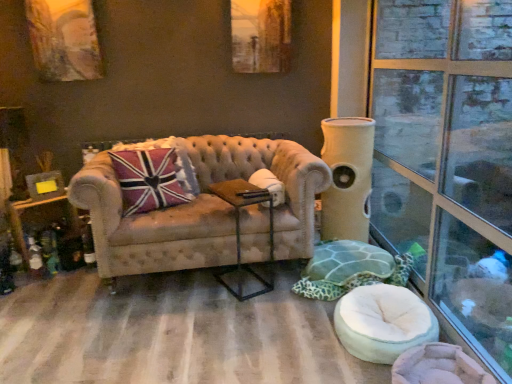
What do you see at coordinates (153, 178) in the screenshot? I see `union jack fabric pillow at center` at bounding box center [153, 178].

What do you see at coordinates (351, 269) in the screenshot? Image resolution: width=512 pixels, height=384 pixels. I see `green fabric swivel chair at lower right, placed as the 2th swivel chair when sorted from front to back` at bounding box center [351, 269].

The height and width of the screenshot is (384, 512). What do you see at coordinates (239, 229) in the screenshot?
I see `metallic brown side table at center` at bounding box center [239, 229].

Identify the location of clear glass window at right. (449, 158).

How much space does white fabric swivel chair at lower right, placed as the second swivel chair when sorted from back to front, occupy vertically?

white fabric swivel chair at lower right, placed as the second swivel chair when sorted from back to front, is 21.66 centimeters in height.

In order to click on union jack fabric pillow at center in this screenshot , I will do `click(153, 178)`.

In the image, there is a clear glass window at right. Identify the location of studio couch below it (from the image's perspective). (205, 211).

Is clear glass window at right looking in the opposite direction of tufted beige couch at center?

No, tufted beige couch at center is not at the back of clear glass window at right.

Does point (478, 162) appear closer or farther from the camera than point (241, 215)?

Point (478, 162).

Does clear glass window at right have a larger size compared to tufted beige couch at center?

Actually, clear glass window at right might be smaller than tufted beige couch at center.

From a real-world perspective, is union jack fabric pillow at center physically below beige fabric cat tower at right?

No, from a real-world perspective, union jack fabric pillow at center is not beneath beige fabric cat tower at right.

Considering the relative sizes of union jack fabric pillow at center and beige fabric cat tower at right in the image provided, is union jack fabric pillow at center smaller than beige fabric cat tower at right?

Yes.

Is union jack fabric pillow at center shorter than beige fabric cat tower at right?

Correct, union jack fabric pillow at center is not as tall as beige fabric cat tower at right.

How many degrees apart are the facing directions of union jack fabric pillow at center and beige fabric cat tower at right?

union jack fabric pillow at center and beige fabric cat tower at right are facing 8.19 degrees away from each other.

From a real-world perspective, which object stands above the other?

In real-world perspective, beige fabric cat tower at right is above.

Who is shorter, white fabric swivel chair at lower right, which is the 1th swivel chair from front to back, or beige fabric cat tower at right?

With less height is white fabric swivel chair at lower right, which is the 1th swivel chair from front to back.

From the image's perspective, between white fabric swivel chair at lower right, which is the 1th swivel chair from front to back, and beige fabric cat tower at right, which one is located above?

From the image's view, beige fabric cat tower at right is above.

Are metallic brown side table at center and white fabric swivel chair at lower right, which is the 1th swivel chair from front to back, located far from each other?

metallic brown side table at center is near white fabric swivel chair at lower right, which is the 1th swivel chair from front to back, not far away.

Identify the location of swivel chair in front of the metallic brown side table at center. (383, 322).

How far apart are metallic brown side table at center and white fabric swivel chair at lower right, which is the 1th swivel chair from front to back?

metallic brown side table at center is 31.57 inches from white fabric swivel chair at lower right, which is the 1th swivel chair from front to back.

From a real-world perspective, who is located higher, metallic brown side table at center or white fabric swivel chair at lower right, which is the 1th swivel chair from front to back?

In real-world perspective, metallic brown side table at center is above.

Does tufted beige couch at center have a greater width compared to clear glass window at right?

Yes, tufted beige couch at center is wider than clear glass window at right.

Considering the sizes of tufted beige couch at center and clear glass window at right in the image, is tufted beige couch at center taller or shorter than clear glass window at right?

Considering their sizes, tufted beige couch at center has less height than clear glass window at right.

The image size is (512, 384). There is a tufted beige couch at center. Identify the location of window frame above it (from a real-world perspective). (449, 158).

Does point (194, 138) appear closer or farther from the camera than point (448, 222)?

Point (194, 138) is positioned farther from the camera compared to point (448, 222).

From the image's perspective, which one is positioned lower, metallic brown side table at center or clear glass window at right?

metallic brown side table at center.

Is metallic brown side table at center aimed at clear glass window at right?

No, metallic brown side table at center is not facing towards clear glass window at right.

Find the location of `window frame on the right of metallic brown side table at center`. window frame on the right of metallic brown side table at center is located at coordinates (449, 158).

Is clear glass window at right completely or partially inside metallic brown side table at center?

Definitely not — clear glass window at right is not inside metallic brown side table at center.

Who is bigger, beige fabric cat tower at right or union jack fabric pillow at center?

beige fabric cat tower at right.

From a real-world perspective, is beige fabric cat tower at right on top of union jack fabric pillow at center?

No, from a real-world perspective, beige fabric cat tower at right is not on top of union jack fabric pillow at center.

Identify the location of pillar behind the union jack fabric pillow at center. The width and height of the screenshot is (512, 384). (347, 178).

Locate an element on the screen. window frame on the right of tufted beige couch at center is located at coordinates (449, 158).

Find the location of `throw pillow on the left of beige fabric cat tower at right`. throw pillow on the left of beige fabric cat tower at right is located at coordinates (153, 178).

Which object lies nearer to the anchor point white fabric swivel chair at lower right, placed as the second swivel chair when sorted from back to front, union jack fabric pillow at center or clear glass window at right?

Among the two, clear glass window at right is located nearer to white fabric swivel chair at lower right, placed as the second swivel chair when sorted from back to front.

Based on the photo, based on their spatial positions, is union jack fabric pillow at center or tufted beige couch at center closer to white fabric swivel chair at lower right, which is the 1th swivel chair from front to back?

tufted beige couch at center is closer to white fabric swivel chair at lower right, which is the 1th swivel chair from front to back.

Considering their positions, is green fabric swivel chair at lower right, placed as the 2th swivel chair when sorted from front to back, positioned closer to union jack fabric pillow at center than beige fabric cat tower at right?

beige fabric cat tower at right is positioned closer to the anchor union jack fabric pillow at center.

Looking at the image, which one is located further to clear glass window at right, beige fabric cat tower at right or tufted beige couch at center?

tufted beige couch at center lies further to clear glass window at right than the other object.

When comparing their distances from metallic brown side table at center, does tufted beige couch at center or white fabric swivel chair at lower right, which is the 1th swivel chair from front to back, seem closer?

Among the two, tufted beige couch at center is located nearer to metallic brown side table at center.

From the image, which object appears to be nearer to tufted beige couch at center, beige fabric cat tower at right or green fabric swivel chair at lower right, placed as the 2th swivel chair when sorted from front to back?

Among the two, green fabric swivel chair at lower right, placed as the 2th swivel chair when sorted from front to back, is located nearer to tufted beige couch at center.

Estimate the real-world distances between objects in this image. Which object is closer to metallic brown side table at center, union jack fabric pillow at center or tufted beige couch at center?

tufted beige couch at center is closer to metallic brown side table at center.

When comparing their distances from union jack fabric pillow at center, does white fabric swivel chair at lower right, which is the 1th swivel chair from front to back, or beige fabric cat tower at right seem further?

white fabric swivel chair at lower right, which is the 1th swivel chair from front to back.

Image resolution: width=512 pixels, height=384 pixels. Identify the location of studio couch between union jack fabric pillow at center and clear glass window at right from left to right. (205, 211).

At what (x,y) coordinates should I click in order to perform the action: click on side table positioned between clear glass window at right and green fabric swivel chair at lower right, placed as the 2th swivel chair when sorted from front to back, from near to far. Please return your answer as a coordinate pair (x, y). Image resolution: width=512 pixels, height=384 pixels. Looking at the image, I should click on (239, 229).

The width and height of the screenshot is (512, 384). I want to click on side table between clear glass window at right and union jack fabric pillow at center along the z-axis, so click(239, 229).

Where is `side table between clear glass window at right and beige fabric cat tower at right from front to back`? The height and width of the screenshot is (384, 512). side table between clear glass window at right and beige fabric cat tower at right from front to back is located at coordinates (239, 229).